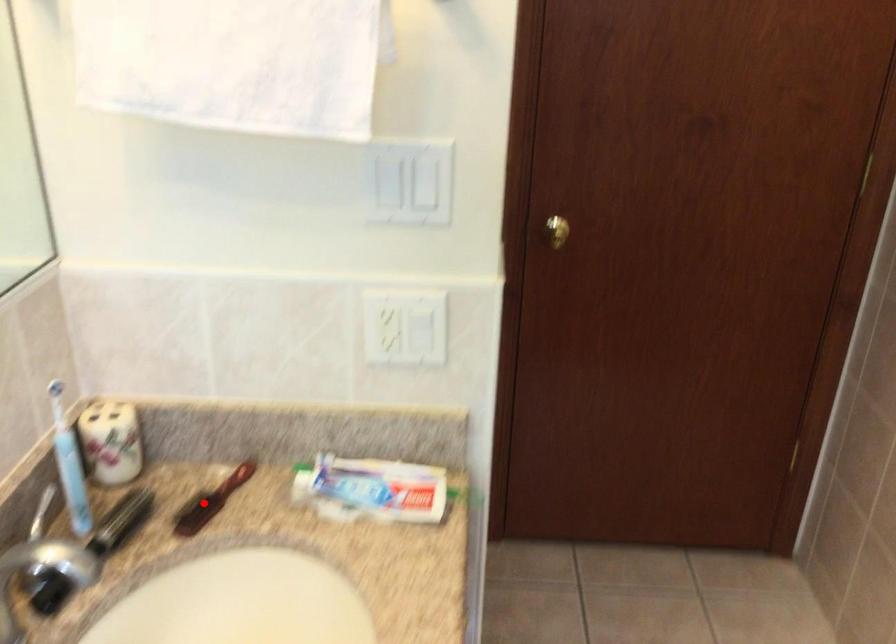
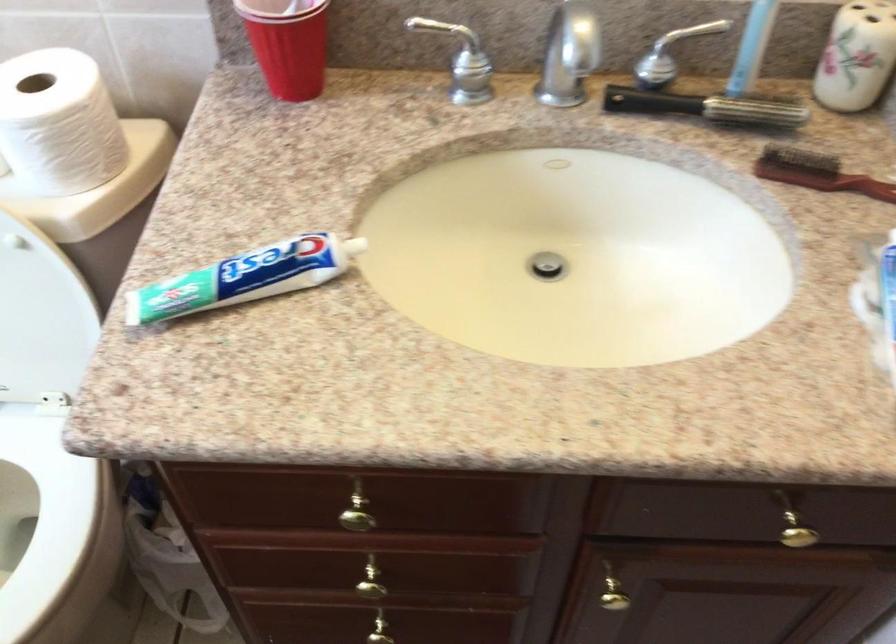
Question: I am providing you with two images of the same scene from different viewpoints. A red point is shown in image1. For the corresponding object point in image2, is it positioned nearer or farther from the camera?

Choices:
 (A) Nearer
 (B) Farther

Answer: (A)